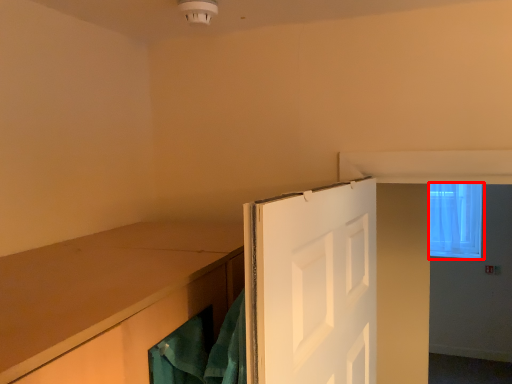
Question: From the image's perspective, what is the correct spatial positioning of window (annotated by the red box) in reference to door?

Choices:
 (A) below
 (B) above

Answer: (B)